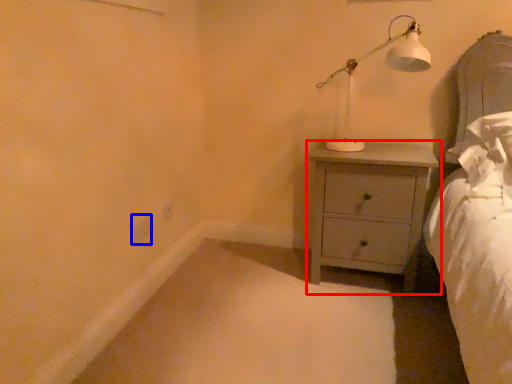
Question: Which point is further to the camera, chest of drawers (highlighted by a red box) or electric outlet (highlighted by a blue box)?

Choices:
 (A) chest of drawers
 (B) electric outlet

Answer: (B)